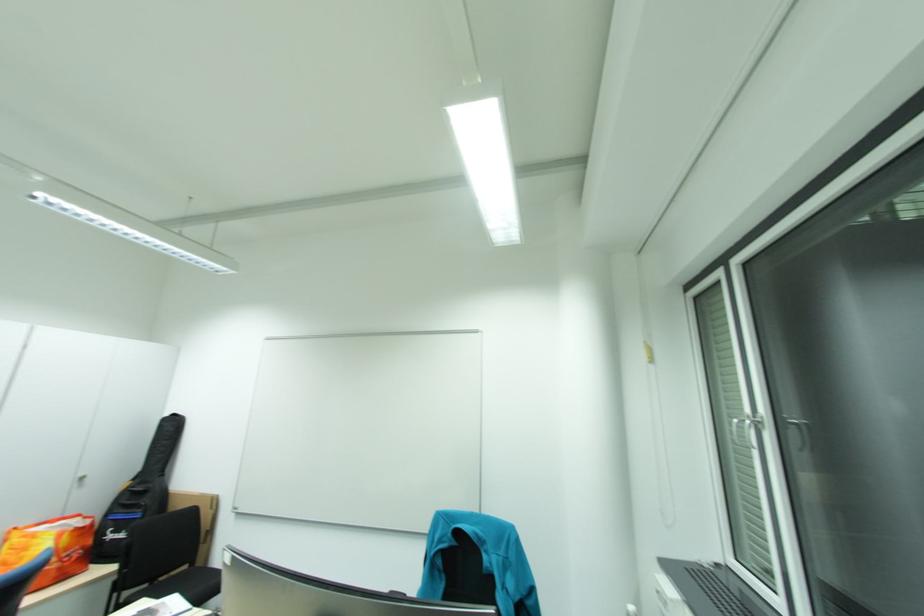
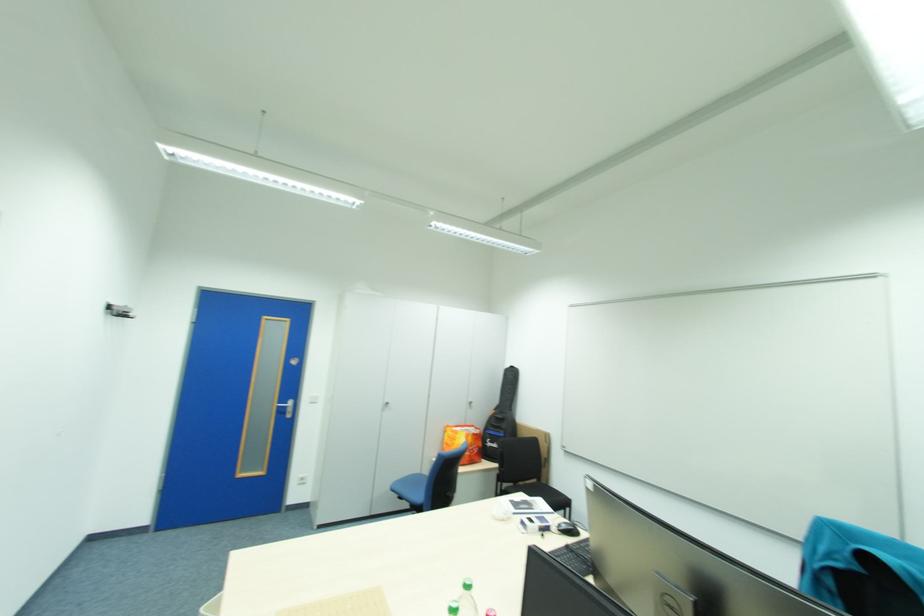
Question: How did the camera likely rotate?

Choices:
 (A) Left
 (B) Right
 (C) Up
 (D) Down

Answer: (A)